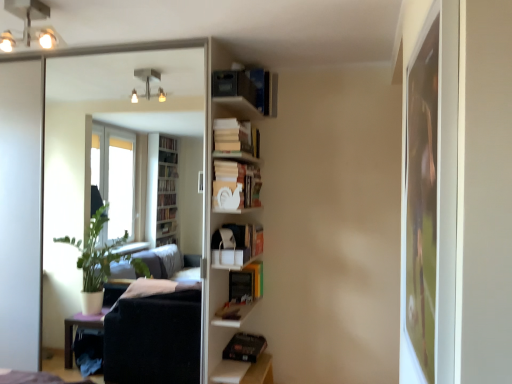
Question: In the image, is matte black bookshelf at upper center, acting as the 5th book starting from the bottom, positioned in front of or behind hardcover book at center, the fourth book when ordered from top to bottom?

Choices:
 (A) front
 (B) behind

Answer: (A)

Question: From a real-world perspective, is matte black bookshelf at upper center, acting as the 5th book starting from the bottom, above or below hardcover book at center, the fourth book when ordered from top to bottom?

Choices:
 (A) below
 (B) above

Answer: (B)

Question: Estimate the real-world distances between objects in this image. Which object is farther from the white glossy bookshelf at upper center?

Choices:
 (A) hardcover book at center, placed as the 2th book when sorted from bottom to top
 (B) matte black bookshelf at upper center, acting as the 5th book starting from the bottom
 (C) white matte cat at center, arranged as the 3th book when ordered from the bottom
 (D) white matte bookshelf at upper center, the second book when ordered from top to bottom
 (E) white matte shelf at center

Answer: (B)

Question: Estimate the real-world distances between objects in this image. Which object is farther from the white matte bookshelf at upper center, the second book when ordered from top to bottom?

Choices:
 (A) hardcover book at center, the fourth book when ordered from top to bottom
 (B) white matte shelf at center
 (C) matte black bookshelf at upper center, acting as the 5th book starting from the bottom
 (D) metallic ceiling lights at upper left
 (E) black matte book at lower center, which is the first book from bottom to top

Answer: (E)